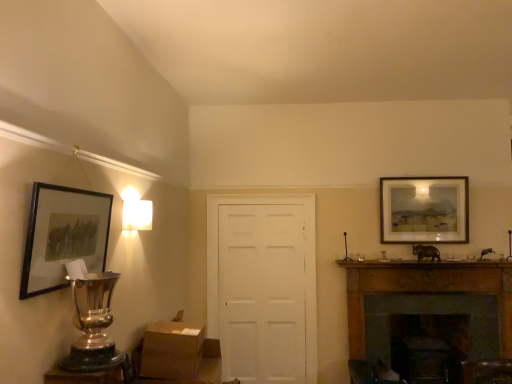
The image size is (512, 384). Describe the element at coordinates (262, 292) in the screenshot. I see `white matte door at center` at that location.

Where is `brown cardboard box at lower center`? This screenshot has width=512, height=384. brown cardboard box at lower center is located at coordinates (172, 351).

Describe the element at coordinates (431, 333) in the screenshot. I see `brown wood fireplace at right` at that location.

What do you see at coordinates (424, 210) in the screenshot?
I see `matte wooden picture frame at upper right, which is the first picture frame in back-to-front order` at bounding box center [424, 210].

You are a GUI agent. You are given a task and a screenshot of the screen. Output one action in this format:
    pyautogui.click(x=<x>, y=<y>)
    Task: Click on the metallic trophy at lower left
    The image size is (512, 384).
    Given the screenshot: What is the action you would take?
    pyautogui.click(x=90, y=374)

Looking at this image, is brown cardboard box at lower center aimed at metallic trophy at lower left?

No, brown cardboard box at lower center is not aimed at metallic trophy at lower left.

Is brown cardboard box at lower center thinner than metallic trophy at lower left?

Incorrect, the width of brown cardboard box at lower center is not less than that of metallic trophy at lower left.

Is brown cardboard box at lower center far from metallic trophy at lower left?

No, brown cardboard box at lower center is not far from metallic trophy at lower left.

Does brown cardboard box at lower center contain metallic trophy at lower left?

No, metallic trophy at lower left is not inside brown cardboard box at lower center.

Is brown wood fireplace at right oriented towards white matte door at center?

No, brown wood fireplace at right is not oriented towards white matte door at center.

Considering the sizes of objects brown wood fireplace at right and white matte door at center in the image provided, who is taller, brown wood fireplace at right or white matte door at center?

With more height is white matte door at center.

Is point (465, 298) behind point (222, 264)?

No, (465, 298) is in front of (222, 264).

Between brown wood fireplace at right and white matte door at center, which one appears on the right side from the viewer's perspective?

Positioned to the right is brown wood fireplace at right.

Is point (228, 332) closer to camera compared to point (403, 377)?

No.

Is white matte door at center situated inside brown wood fireplace at right or outside?

white matte door at center is outside brown wood fireplace at right.

Are white matte door at center and brown wood fireplace at right beside each other?

white matte door at center and brown wood fireplace at right are not in contact.

How many degrees apart are the facing directions of white matte door at center and brown wood fireplace at right?

The angular difference between white matte door at center and brown wood fireplace at right is 1.99 degrees.

From the image's perspective, is white matte door at center located above metallic trophy at lower left?

Incorrect, from the image's perspective, white matte door at center is lower than metallic trophy at lower left.

Considering the relative sizes of white matte door at center and metallic trophy at lower left in the image provided, is white matte door at center shorter than metallic trophy at lower left?

In fact, white matte door at center may be taller than metallic trophy at lower left.

Can you confirm if white matte door at center is wider than metallic trophy at lower left?

No.

Choose the correct answer: Is matte black picture frame at left, arranged as the 1th picture frame when viewed from the front, inside brown cardboard box at lower center or outside it?

matte black picture frame at left, arranged as the 1th picture frame when viewed from the front, is not inside brown cardboard box at lower center, it's outside.

Which is farther, (34, 220) or (199, 332)?

The point (199, 332) is farther.

Is matte black picture frame at left, which ranks as the second picture frame in right-to-left order, beside brown cardboard box at lower center?

No, matte black picture frame at left, which ranks as the second picture frame in right-to-left order, is not next to brown cardboard box at lower center.

Considering the sizes of objects matte black picture frame at left, arranged as the 1th picture frame when viewed from the front, and brown cardboard box at lower center in the image provided, who is thinner, matte black picture frame at left, arranged as the 1th picture frame when viewed from the front, or brown cardboard box at lower center?

matte black picture frame at left, arranged as the 1th picture frame when viewed from the front, is thinner.

Does metallic trophy at lower left have a greater width compared to matte wooden picture frame at upper right, which is the 2th picture frame from front to back?

Yes.

Based on their positions, is metallic trophy at lower left located to the left or right of matte wooden picture frame at upper right, acting as the 1th picture frame starting from the right?

Based on their positions, metallic trophy at lower left is located to the left of matte wooden picture frame at upper right, acting as the 1th picture frame starting from the right.

From a real-world perspective, which object stands above the other?

matte wooden picture frame at upper right, the second picture frame from the left.

From the image's perspective, who appears lower, metallic trophy at lower left or matte wooden picture frame at upper right, acting as the 1th picture frame starting from the right?

From the image's view, metallic trophy at lower left is below.

In the scene shown: Is white matte door at center with matte wooden picture frame at upper right, which is the first picture frame in back-to-front order?

No, white matte door at center is not next to matte wooden picture frame at upper right, which is the first picture frame in back-to-front order.

From a real-world perspective, is white matte door at center above or below matte wooden picture frame at upper right, which is the 2th picture frame from front to back?

Clearly, from a real-world perspective, white matte door at center is below matte wooden picture frame at upper right, which is the 2th picture frame from front to back.

Can we say white matte door at center lies outside matte wooden picture frame at upper right, acting as the 1th picture frame starting from the right?

Yes, white matte door at center is not within matte wooden picture frame at upper right, acting as the 1th picture frame starting from the right.

Is white matte door at center positioned with its back to matte wooden picture frame at upper right, acting as the 1th picture frame starting from the right?

That's not correct — white matte door at center is not looking away from matte wooden picture frame at upper right, acting as the 1th picture frame starting from the right.

Identify the location of table on the left of the brown cardboard box at lower center. (90, 374).

Locate an element on the screen. The height and width of the screenshot is (384, 512). door behind the brown wood fireplace at right is located at coordinates (262, 292).

Considering their positions, is white matte door at center positioned further to metallic trophy at lower left than brown wood fireplace at right?

brown wood fireplace at right.

Looking at the image, which one is located further to metallic trophy at lower left, matte wooden picture frame at upper right, which is the first picture frame in back-to-front order, or brown cardboard box at lower center?

matte wooden picture frame at upper right, which is the first picture frame in back-to-front order.

Estimate the real-world distances between objects in this image. Which object is further from matte wooden picture frame at upper right, which is the first picture frame in back-to-front order, brown cardboard box at lower center or metallic trophy at lower left?

Based on the image, metallic trophy at lower left appears to be further to matte wooden picture frame at upper right, which is the first picture frame in back-to-front order.

Based on the photo, when comparing their distances from matte black picture frame at left, the 2th picture frame positioned from the back, does brown cardboard box at lower center or white matte door at center seem further?

white matte door at center is positioned further to the anchor matte black picture frame at left, the 2th picture frame positioned from the back.

Estimate the real-world distances between objects in this image. Which object is further from brown wood fireplace at right, matte black picture frame at left, the first picture frame from the left, or matte wooden picture frame at upper right, acting as the 1th picture frame starting from the right?

matte black picture frame at left, the first picture frame from the left, is further to brown wood fireplace at right.

Looking at the image, which one is located closer to matte wooden picture frame at upper right, acting as the 1th picture frame starting from the right, matte black picture frame at left, the first picture frame from the left, or brown wood fireplace at right?

Among the two, brown wood fireplace at right is located nearer to matte wooden picture frame at upper right, acting as the 1th picture frame starting from the right.

Considering their positions, is metallic trophy at lower left positioned closer to white matte door at center than brown wood fireplace at right?

→ The object closer to white matte door at center is brown wood fireplace at right.

Consider the image. Considering their positions, is brown cardboard box at lower center positioned further to matte wooden picture frame at upper right, which is the first picture frame in back-to-front order, than brown wood fireplace at right?

Based on the image, brown cardboard box at lower center appears to be further to matte wooden picture frame at upper right, which is the first picture frame in back-to-front order.

I want to click on picture frame between metallic trophy at lower left and white matte door at center along the z-axis, so click(424, 210).

Where is `table situated between matte black picture frame at left, which ranks as the second picture frame in right-to-left order, and matte wooden picture frame at upper right, acting as the 1th picture frame starting from the right, from left to right`? table situated between matte black picture frame at left, which ranks as the second picture frame in right-to-left order, and matte wooden picture frame at upper right, acting as the 1th picture frame starting from the right, from left to right is located at coordinates (90, 374).

The height and width of the screenshot is (384, 512). I want to click on cardboard box located between metallic trophy at lower left and white matte door at center in the depth direction, so click(172, 351).

This screenshot has width=512, height=384. Identify the location of fireplace situated between brown cardboard box at lower center and matte wooden picture frame at upper right, which is the first picture frame in back-to-front order, from left to right. (431, 333).